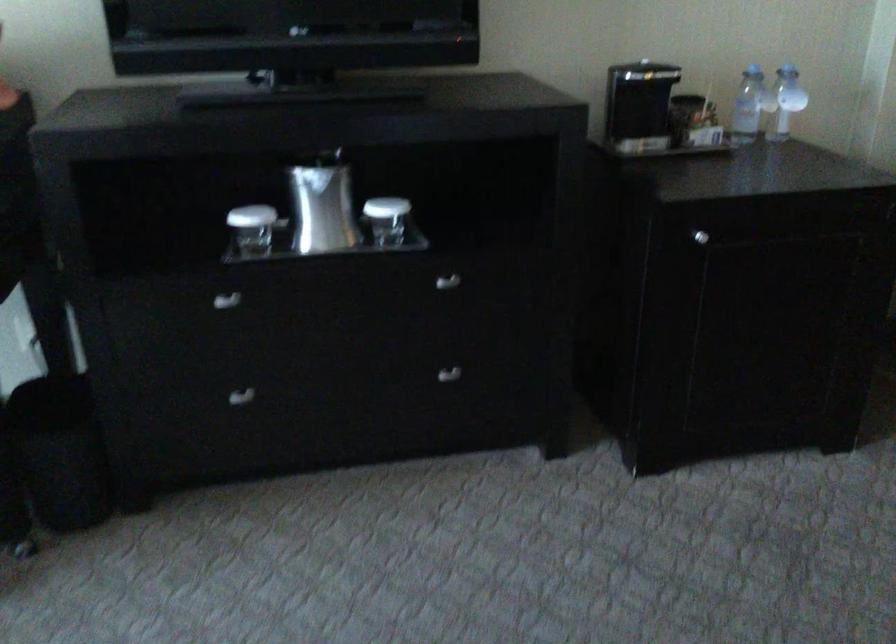
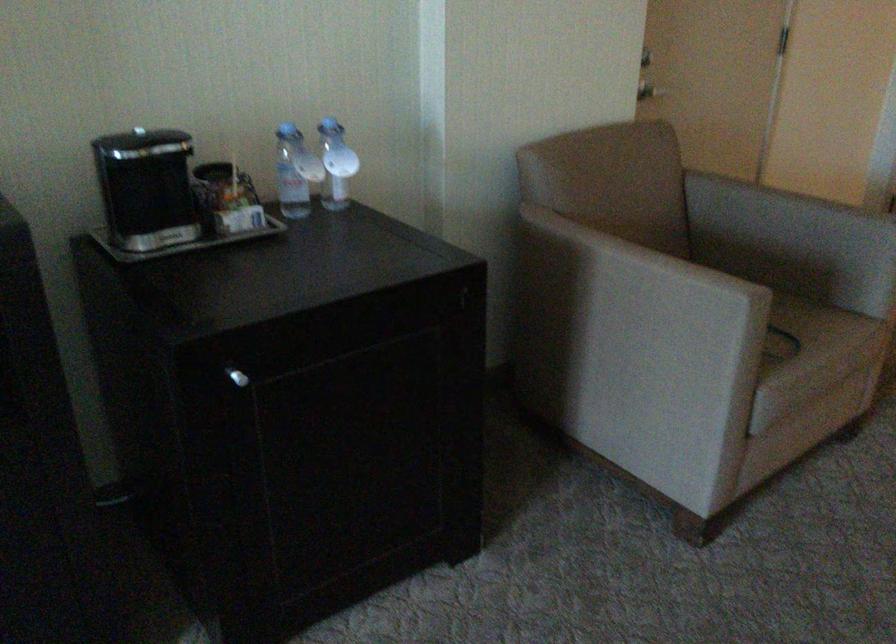
Find the pixel in the second image that matches (x=687, y=90) in the first image.

(212, 171)